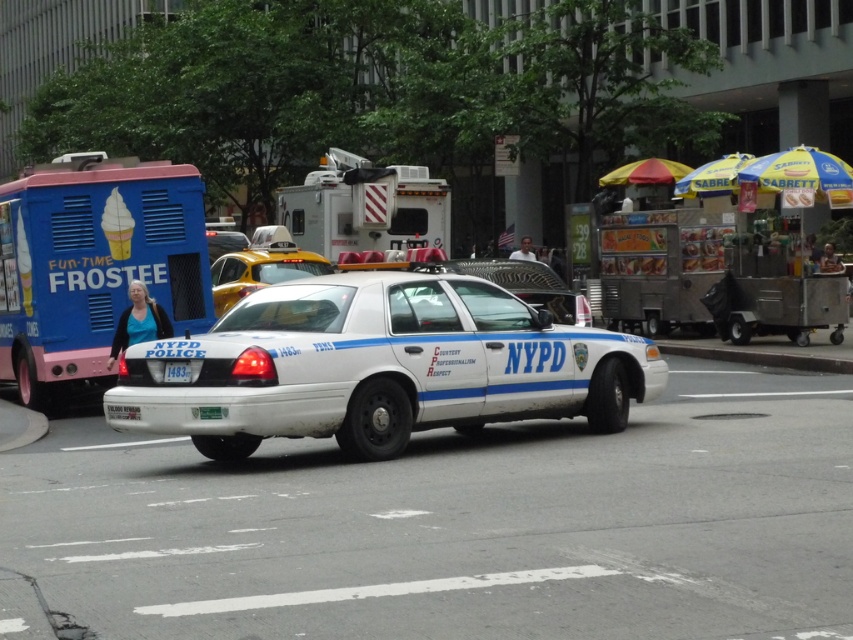
Is the position of blue painted ice cream truck at left more distant than that of yellowsmoothtaxi at center?

No, it is in front of yellowsmoothtaxi at center.

Is point (42, 202) behind point (296, 260)?

That is False.

At what (x,y) coordinates should I click in order to perform the action: click on blue painted ice cream truck at left. Please return your answer as a coordinate pair (x, y). This screenshot has height=640, width=853. Looking at the image, I should click on (93, 262).

Measure the distance between white glossy police car at center and yellowsmoothtaxi at center.

white glossy police car at center and yellowsmoothtaxi at center are 9.02 meters apart from each other.

Between white glossy police car at center and yellowsmoothtaxi at center, which one is positioned higher?

yellowsmoothtaxi at center is above.

What do you see at coordinates (379, 365) in the screenshot?
I see `white glossy police car at center` at bounding box center [379, 365].

Identify the location of white glossy police car at center. This screenshot has height=640, width=853. pos(379,365).

Between white plastic food truck at center and yellowsmoothtaxi at center, which one appears on the left side from the viewer's perspective?

yellowsmoothtaxi at center

Does point (434, 193) come in front of point (281, 264)?

No, it is behind (281, 264).

You are a GUI agent. You are given a task and a screenshot of the screen. Output one action in this format:
    pyautogui.click(x=<x>, y=<y>)
    Task: Click on the white plastic food truck at center
    This screenshot has height=640, width=853.
    Given the screenshot: What is the action you would take?
    pyautogui.click(x=364, y=208)